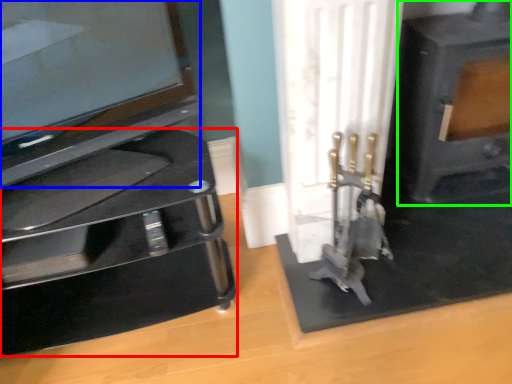
Question: Estimate the real-world distances between objects in this image. Which object is closer to furniture (highlighted by a red box), television (highlighted by a blue box) or fireplace (highlighted by a green box)?

Choices:
 (A) television
 (B) fireplace

Answer: (A)